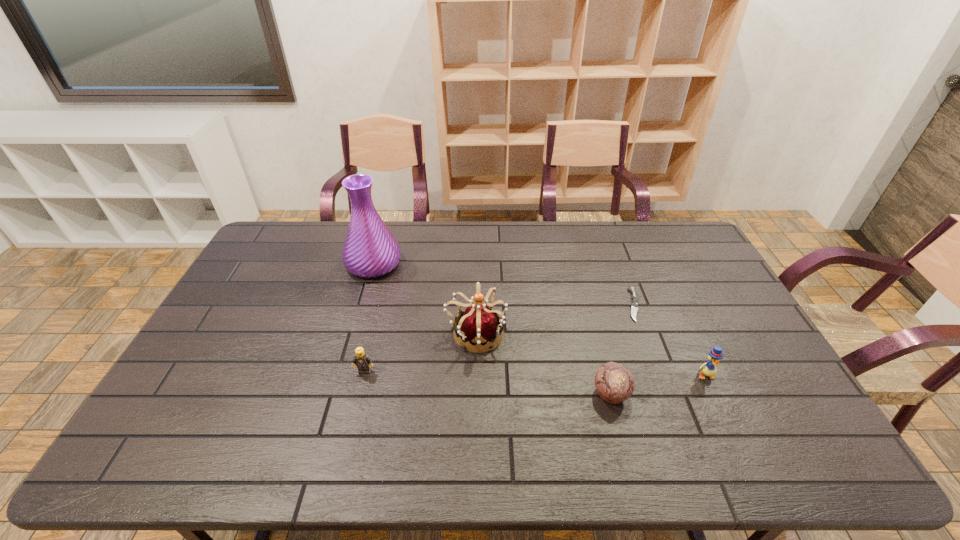
What are the coordinates of `vase` in the screenshot? It's located at (370, 250).

Identify the location of the tallest object. (370, 250).

This screenshot has width=960, height=540. What are the coordinates of `the second tallest object` in the screenshot? It's located at (478, 324).

Identify the location of tiara. (478, 324).

What are the coordinates of `the rightmost object` in the screenshot? It's located at (715, 355).

Locate an element on the screen. The image size is (960, 540). Lego is located at coordinates (361, 360).

Locate an element on the screen. This screenshot has height=540, width=960. muffin is located at coordinates (614, 383).

The width and height of the screenshot is (960, 540). What are the coordinates of `the shortest object` in the screenshot? It's located at (634, 308).

Image resolution: width=960 pixels, height=540 pixels. Find the location of `pocketknife`. pocketknife is located at coordinates (634, 308).

The image size is (960, 540). I want to click on free point located 0.090m on the back of the vase, so click(383, 233).